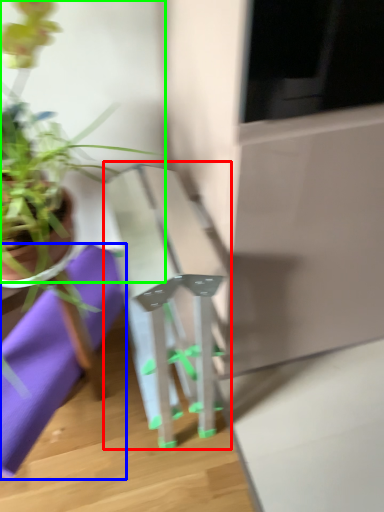
Question: Estimate the real-world distances between objects in this image. Which object is farther from table (highlighted by a red box), cloth (highlighted by a blue box) or houseplant (highlighted by a green box)?

Choices:
 (A) cloth
 (B) houseplant

Answer: (B)